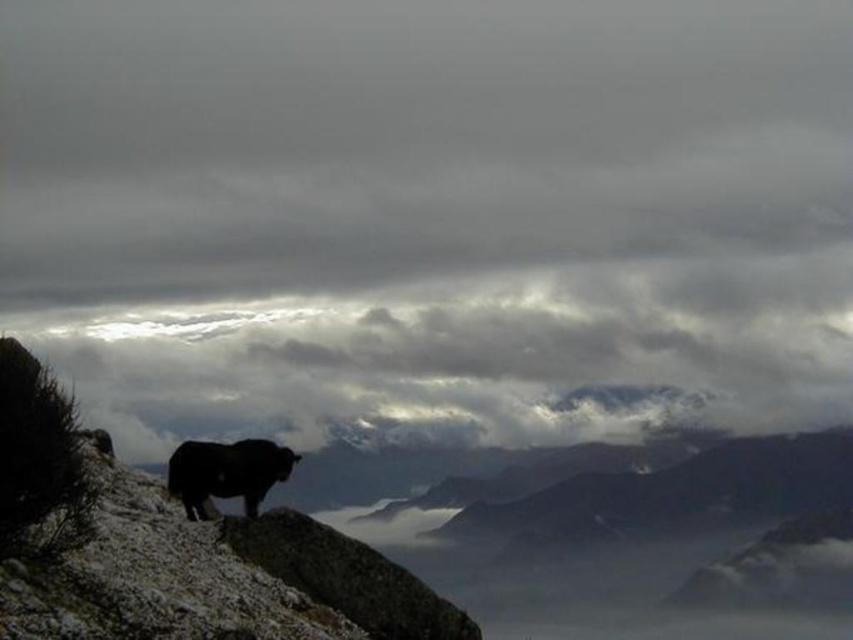
You are an animal photographer aiming to capture the black fur at center against the cloudy gray sky at upper center. Based on the scene, which object takes up more space in the image?

The cloudy gray sky at upper center takes up more space in the image as it is bigger than the black fur at center.

You are an animal tracker observing the scene. You notice the cloudy gray sky at upper center and the black fur at center. Which object is located to the right of the other?

The black fur at center is located to the right of the cloudy gray sky at upper center because the cloudy gray sky at upper center is positioned on the left side of black fur at center.